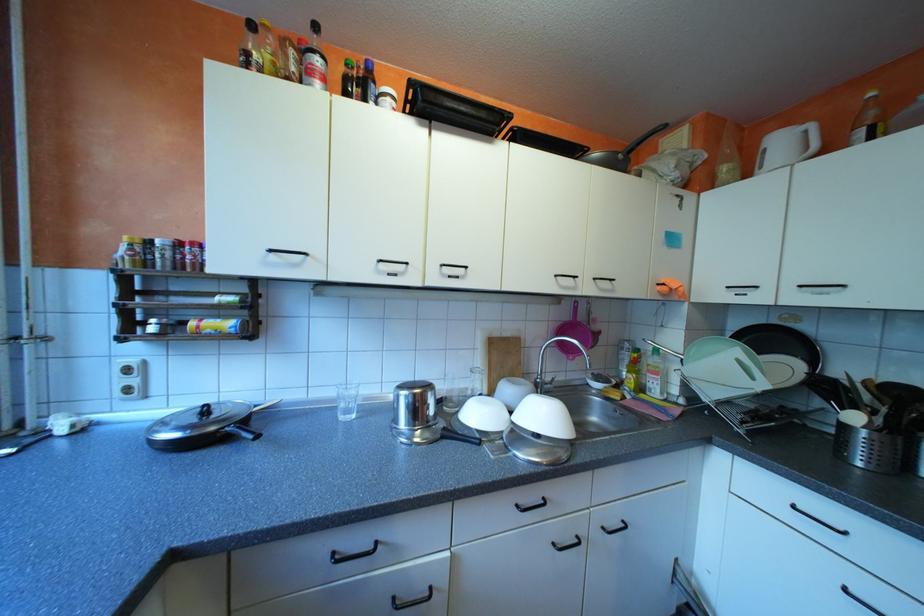
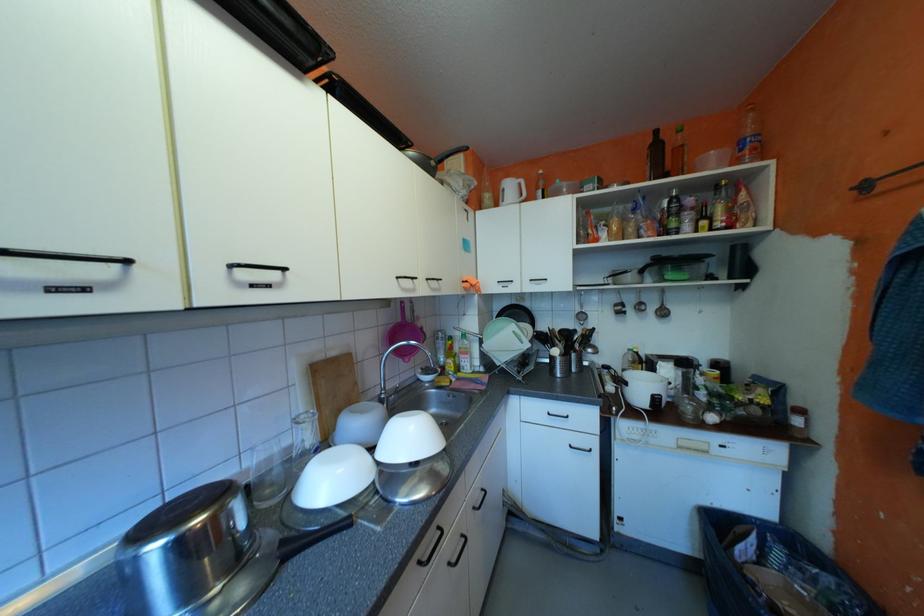
Question: How did the camera likely rotate?

Choices:
 (A) Left
 (B) Right
 (C) Up
 (D) Down

Answer: (B)